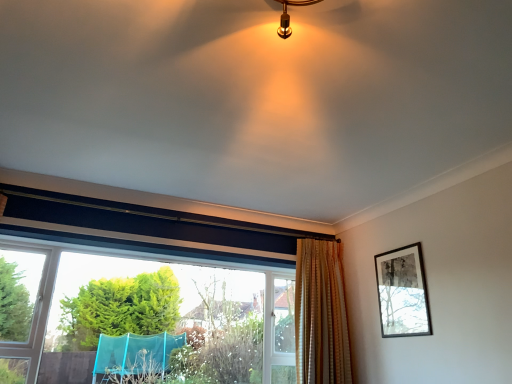
Question: From a real-world perspective, is gold textured curtain at center positioned above or below black matte picture frame at upper right?

Choices:
 (A) below
 (B) above

Answer: (A)

Question: Is gold textured curtain at center bigger or smaller than black matte picture frame at upper right?

Choices:
 (A) big
 (B) small

Answer: (A)

Question: Estimate the real-world distances between objects in this image. Which object is closer to the clear glass window at lower left?

Choices:
 (A) gold textured curtain at center
 (B) black matte picture frame at upper right

Answer: (A)

Question: Which object is positioned closest to the clear glass window at lower left?

Choices:
 (A) black matte picture frame at upper right
 (B) gold textured curtain at center

Answer: (B)